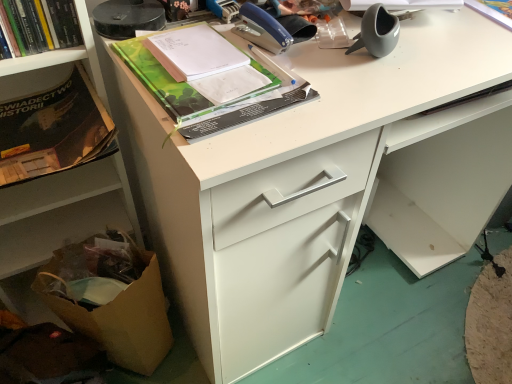
Question: Is matte black book at left placed right next to matte gray vase at upper right, which is the 2th office supplies in left-to-right order?

Choices:
 (A) yes
 (B) no

Answer: (B)

Question: Is matte black book at left to the right of matte gray vase at upper right, the 1th office supplies positioned from the right, from the viewer's perspective?

Choices:
 (A) yes
 (B) no

Answer: (B)

Question: Considering the relative sizes of matte black book at left and matte gray vase at upper right, which is the 2th office supplies in left-to-right order, in the image provided, is matte black book at left bigger than matte gray vase at upper right, which is the 2th office supplies in left-to-right order,?

Choices:
 (A) no
 (B) yes

Answer: (B)

Question: Is matte black book at left smaller than matte gray vase at upper right, the 1th office supplies positioned from the right?

Choices:
 (A) yes
 (B) no

Answer: (B)

Question: Can you confirm if matte black book at left is taller than matte gray vase at upper right, the 1th office supplies positioned from the right?

Choices:
 (A) no
 (B) yes

Answer: (B)

Question: Is matte black book at left positioned with its back to matte gray vase at upper right, the 1th office supplies positioned from the right?

Choices:
 (A) no
 (B) yes

Answer: (A)

Question: Does hardcover book at upper left, which is the 1th book in left-to-right order, have a smaller size compared to matte gray vase at upper right, which is the 2th office supplies in left-to-right order?

Choices:
 (A) yes
 (B) no

Answer: (B)

Question: Is hardcover book at upper left, the third book positioned from the right, outside of matte gray vase at upper right, the 1th office supplies positioned from the right?

Choices:
 (A) no
 (B) yes

Answer: (B)

Question: Considering the relative positions of hardcover book at upper left, the third book positioned from the right, and matte gray vase at upper right, which is the 2th office supplies in left-to-right order, in the image provided, is hardcover book at upper left, the third book positioned from the right, in front of matte gray vase at upper right, which is the 2th office supplies in left-to-right order,?

Choices:
 (A) no
 (B) yes

Answer: (B)

Question: From the image's perspective, is hardcover book at upper left, which is the 1th book in left-to-right order, above matte gray vase at upper right, which is the 2th office supplies in left-to-right order?

Choices:
 (A) yes
 (B) no

Answer: (A)

Question: Does hardcover book at upper left, the third book positioned from the right, lie behind matte gray vase at upper right, which is the 2th office supplies in left-to-right order?

Choices:
 (A) yes
 (B) no

Answer: (B)

Question: Is hardcover book at upper left, which is the 1th book in left-to-right order, aimed at matte gray vase at upper right, the 1th office supplies positioned from the right?

Choices:
 (A) yes
 (B) no

Answer: (B)

Question: Is green matte book at upper center, acting as the 2th book starting from the right, positioned in front of white paper at upper right, which is the first book from right to left?

Choices:
 (A) yes
 (B) no

Answer: (A)